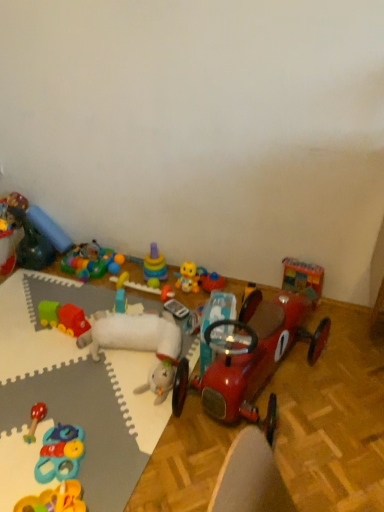
Locate an element on the screen. The height and width of the screenshot is (512, 384). empty space that is to the right of shiny red car at center, marked as the eleventh toy in a left-to-right arrangement is located at coordinates (347, 380).